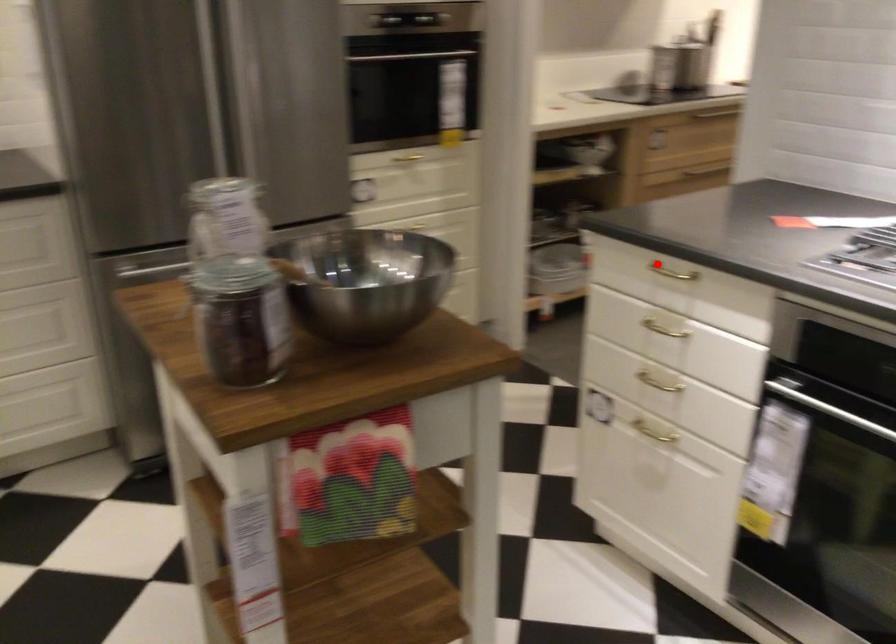
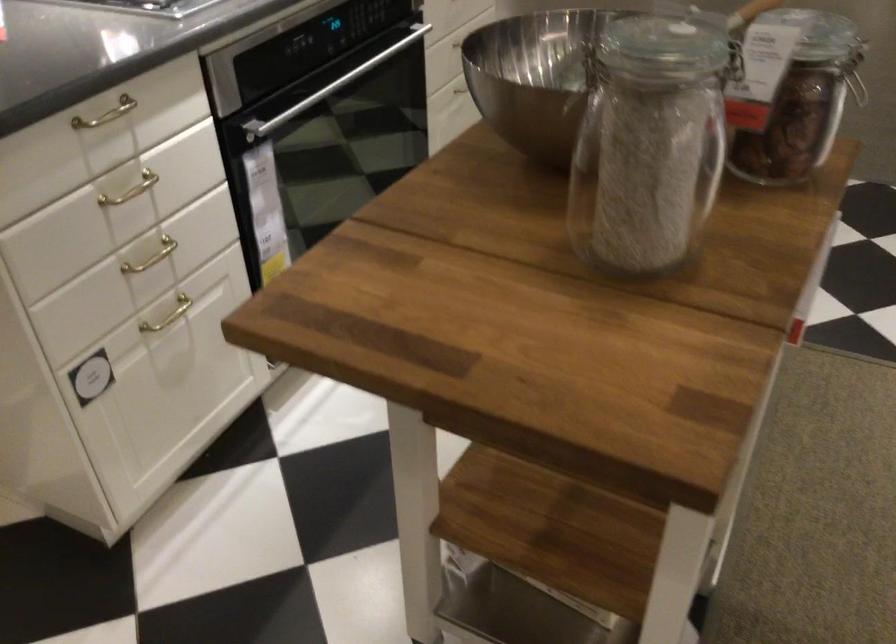
Question: I am providing you with two images of the same scene from different viewpoints. In image1, a red point is highlighted. Considering the same 3D point in image2, which of the following is correct?

Choices:
 (A) It is closer
 (B) It is farther

Answer: (A)